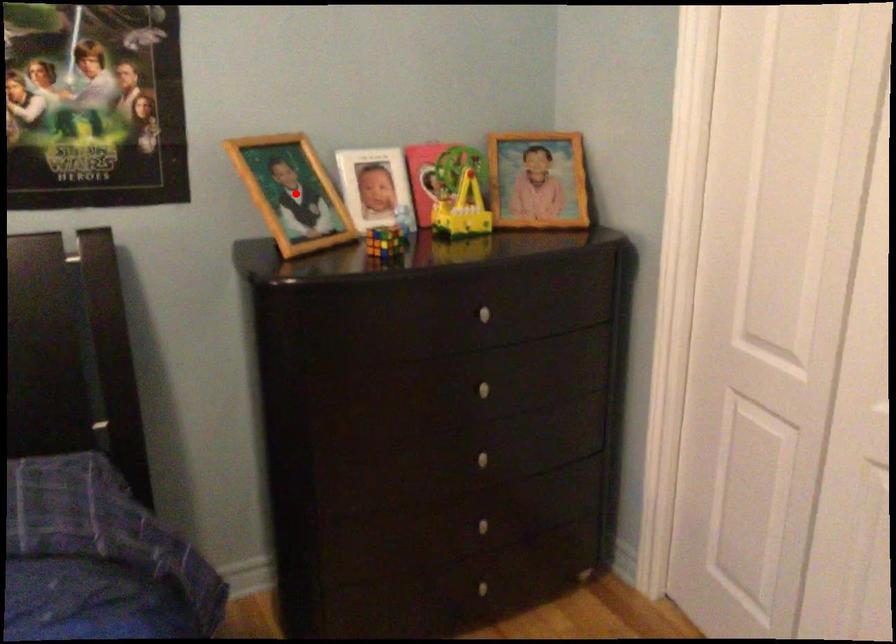
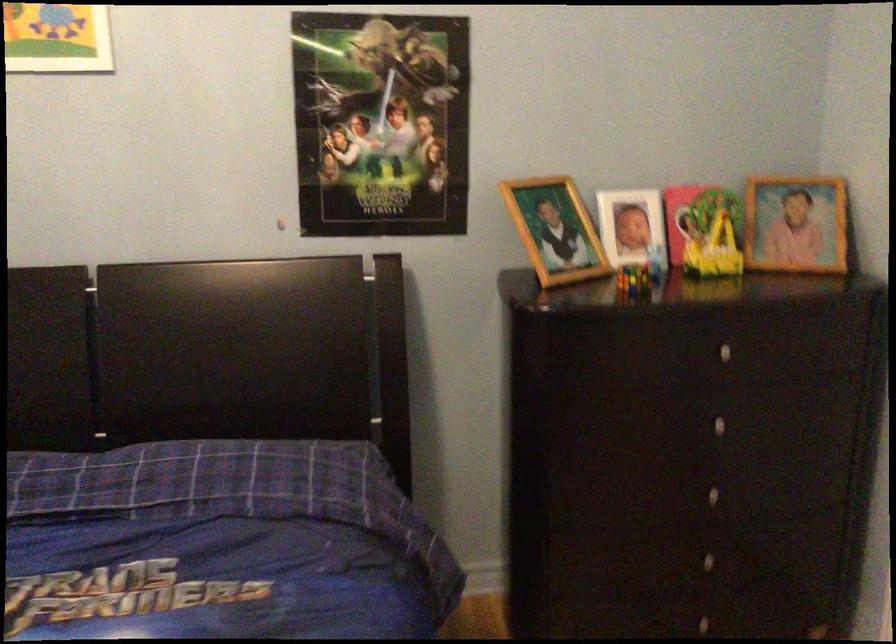
Where in the second image is the point corresponding to the highlighted location from the first image?

(555, 230)